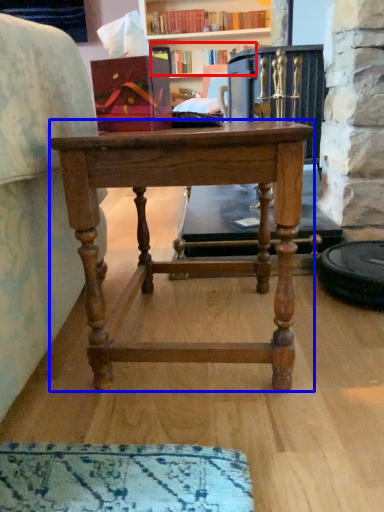
Question: Which of the following is the farthest to the observer, book (highlighted by a red box) or desk (highlighted by a blue box)?

Choices:
 (A) book
 (B) desk

Answer: (A)